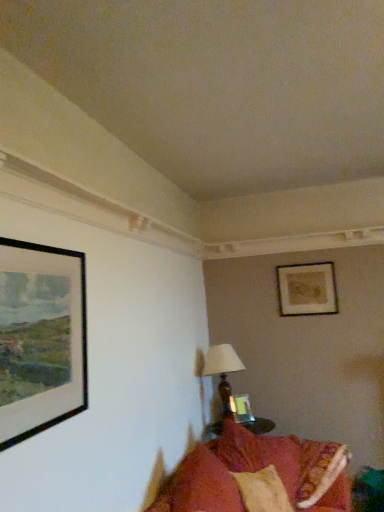
Where is `matte gold picture frame at upper right, positioned as the 1th picture frame in back-to-front order`? matte gold picture frame at upper right, positioned as the 1th picture frame in back-to-front order is located at coordinates (307, 289).

Describe the element at coordinates (199, 486) in the screenshot. I see `velvety orange pillow at lower right` at that location.

What is the approximate height of velvet red couch at lower right?

16.51 inches.

In order to click on matte gold picture frame at upper right, positioned as the 1th picture frame in back-to-front order in this screenshot , I will do `click(307, 289)`.

Is matte brown table lamp at center positioned before matte gold picture frame at upper right, the third picture frame from the left?

Yes, matte brown table lamp at center is in front of matte gold picture frame at upper right, the third picture frame from the left.

Considering the sizes of objects matte brown table lamp at center and matte gold picture frame at upper right, the 3th picture frame from the front, in the image provided, who is thinner, matte brown table lamp at center or matte gold picture frame at upper right, the 3th picture frame from the front,?

matte gold picture frame at upper right, the 3th picture frame from the front.

Does matte brown table lamp at center have a larger size compared to matte gold picture frame at upper right, acting as the 3th picture frame starting from the bottom?

Yes.

From the image's perspective, who appears lower, matte brown table lamp at center or matte gold picture frame at upper right, the third picture frame from the left?

matte brown table lamp at center is shown below in the image.

Between matte glass picture frame at center, which is counted as the 3th picture frame, starting from the top, and velvet red couch at lower right, which one has larger size?

velvet red couch at lower right.

Who is taller, matte glass picture frame at center, the second picture frame from the right, or velvet red couch at lower right?

With more height is velvet red couch at lower right.

Locate an element on the screen. The height and width of the screenshot is (512, 384). picture frame that is the 1st one when counting rightward from the velvet red couch at lower right is located at coordinates (241, 409).

What's the angular difference between matte brown table lamp at center and velvet red couch at lower right's facing directions?

They differ by 49.6 degrees in their facing directions.

Can you confirm if matte brown table lamp at center is taller than velvet red couch at lower right?

Correct, matte brown table lamp at center is much taller as velvet red couch at lower right.

From the picture: From the image's perspective, who appears lower, matte brown table lamp at center or velvet red couch at lower right?

matte brown table lamp at center appears lower in the image.

Can you confirm if matte brown table lamp at center is positioned to the left of velvet red couch at lower right?

No, matte brown table lamp at center is not to the left of velvet red couch at lower right.

Can you confirm if matte gold picture frame at upper right, marked as the first picture frame in a top-to-bottom arrangement, is wider than velvety orange pillow at lower right?

In fact, matte gold picture frame at upper right, marked as the first picture frame in a top-to-bottom arrangement, might be narrower than velvety orange pillow at lower right.

From the velvety orange pillow at lower right, count 2nd picture frame to the right and point to it. Please provide its 2D coordinates.

[(307, 289)]

Could you tell me if matte gold picture frame at upper right, the third picture frame from the left, is facing velvety orange pillow at lower right?

No, matte gold picture frame at upper right, the third picture frame from the left, is not oriented towards velvety orange pillow at lower right.

Which is less distant, [79,255] or [225,501]?

The point [79,255] is closer.

In the scene shown: From the image's perspective, is black matte picture frame at left, the 3th picture frame viewed from the right, above or below velvet red couch at lower right?

Based on their image positions, black matte picture frame at left, the 3th picture frame viewed from the right, is located above velvet red couch at lower right.

Considering the sizes of objects black matte picture frame at left, which appears as the first picture frame when viewed from the front, and velvet red couch at lower right in the image provided, who is bigger, black matte picture frame at left, which appears as the first picture frame when viewed from the front, or velvet red couch at lower right?

Bigger between the two is velvet red couch at lower right.

From a real-world perspective, who is located lower, black matte picture frame at left, the 3th picture frame viewed from the right, or velvet red couch at lower right?

velvet red couch at lower right.

Is the depth of matte gold picture frame at upper right, placed as the 1th picture frame when sorted from right to left, greater than that of velvet red couch at lower right?

Yes, matte gold picture frame at upper right, placed as the 1th picture frame when sorted from right to left, is further from the camera.

In the scene shown: From the image's perspective, is matte gold picture frame at upper right, acting as the 3th picture frame starting from the bottom, over velvet red couch at lower right?

Yes, from the image's perspective, matte gold picture frame at upper right, acting as the 3th picture frame starting from the bottom, is on top of velvet red couch at lower right.

Is matte gold picture frame at upper right, marked as the first picture frame in a top-to-bottom arrangement, taller than velvet red couch at lower right?

Indeed, matte gold picture frame at upper right, marked as the first picture frame in a top-to-bottom arrangement, has a greater height compared to velvet red couch at lower right.

Consider the image. Is matte gold picture frame at upper right, acting as the 3th picture frame starting from the bottom, positioned far away from velvet red couch at lower right?

matte gold picture frame at upper right, acting as the 3th picture frame starting from the bottom, is positioned a significant distance from velvet red couch at lower right.

Which object is positioned more to the right, velvety orange pillow at lower right or matte gold picture frame at upper right, acting as the 3th picture frame starting from the bottom?

From the viewer's perspective, matte gold picture frame at upper right, acting as the 3th picture frame starting from the bottom, appears more on the right side.

In the scene shown: From a real-world perspective, is velvety orange pillow at lower right physically below matte gold picture frame at upper right, placed as the 1th picture frame when sorted from right to left?

Yes, from a real-world perspective, velvety orange pillow at lower right is beneath matte gold picture frame at upper right, placed as the 1th picture frame when sorted from right to left.

How different are the orientations of velvety orange pillow at lower right and matte gold picture frame at upper right, the 3th picture frame from the front, in degrees?

The angular difference between velvety orange pillow at lower right and matte gold picture frame at upper right, the 3th picture frame from the front, is 101 degrees.

I want to click on table lamp lying on the left of matte gold picture frame at upper right, placed as the 1th picture frame when sorted from right to left, so click(223, 371).

The height and width of the screenshot is (512, 384). I want to click on picture frame below the velvet red couch at lower right (from a real-world perspective), so click(x=241, y=409).

From the image, which object appears to be farther from matte gold picture frame at upper right, the third picture frame from the left, matte brown table lamp at center or velvety orange pillow at lower right?

Among the two, velvety orange pillow at lower right is located further to matte gold picture frame at upper right, the third picture frame from the left.

Estimate the real-world distances between objects in this image. Which object is further from matte gold picture frame at upper right, marked as the first picture frame in a top-to-bottom arrangement, matte brown table lamp at center or velvet red couch at lower right?

velvet red couch at lower right lies further to matte gold picture frame at upper right, marked as the first picture frame in a top-to-bottom arrangement, than the other object.

Estimate the real-world distances between objects in this image. Which object is further from velvet red couch at lower right, black matte picture frame at left, positioned as the 2th picture frame in top-to-bottom order, or matte gold picture frame at upper right, the third picture frame from the left?

The object further to velvet red couch at lower right is matte gold picture frame at upper right, the third picture frame from the left.

From the image, which object appears to be farther from matte brown table lamp at center, matte gold picture frame at upper right, the third picture frame from the left, or black matte picture frame at left, positioned as the 2th picture frame in top-to-bottom order?

Among the two, black matte picture frame at left, positioned as the 2th picture frame in top-to-bottom order, is located further to matte brown table lamp at center.

Which object lies further to the anchor point matte gold picture frame at upper right, positioned as the 1th picture frame in back-to-front order, velvet red couch at lower right or matte glass picture frame at center, marked as the 1th picture frame in a bottom-to-top arrangement?

velvet red couch at lower right lies further to matte gold picture frame at upper right, positioned as the 1th picture frame in back-to-front order, than the other object.

From the image, which object appears to be nearer to matte brown table lamp at center, black matte picture frame at left, which appears as the second picture frame when ordered from the bottom, or matte glass picture frame at center, acting as the 2th picture frame starting from the left?

matte glass picture frame at center, acting as the 2th picture frame starting from the left, is positioned closer to the anchor matte brown table lamp at center.

Considering their positions, is matte gold picture frame at upper right, placed as the 1th picture frame when sorted from right to left, positioned closer to black matte picture frame at left, which appears as the second picture frame when ordered from the bottom, than matte brown table lamp at center?

Among the two, matte brown table lamp at center is located nearer to black matte picture frame at left, which appears as the second picture frame when ordered from the bottom.

Considering their positions, is matte brown table lamp at center positioned closer to black matte picture frame at left, positioned as the 2th picture frame in top-to-bottom order, than matte glass picture frame at center, which is counted as the 3th picture frame, starting from the top?

matte brown table lamp at center is positioned closer to the anchor black matte picture frame at left, positioned as the 2th picture frame in top-to-bottom order.

Identify the location of pillow positioned between black matte picture frame at left, which appears as the first picture frame when viewed from the front, and matte glass picture frame at center, the 2th picture frame in the front-to-back sequence, from near to far. (199, 486).

The image size is (384, 512). What are the coordinates of `studio couch between black matte picture frame at left, the first picture frame positioned from the left, and velvety orange pillow at lower right, in the vertical direction` in the screenshot? It's located at (258, 476).

Find the location of `pillow between velvet red couch at lower right and matte glass picture frame at center, which is counted as the 2th picture frame, starting from the back, from front to back`. pillow between velvet red couch at lower right and matte glass picture frame at center, which is counted as the 2th picture frame, starting from the back, from front to back is located at coordinates (199, 486).

Identify the location of pillow positioned between velvet red couch at lower right and matte brown table lamp at center from near to far. This screenshot has height=512, width=384. (199, 486).